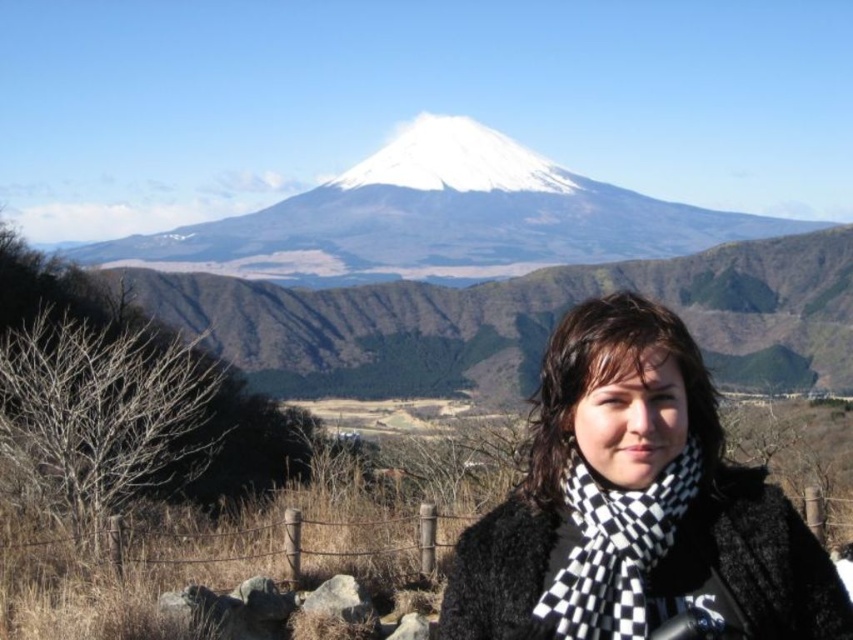
Looking at this image, you are a photographer trying to capture a photo of the black checkered scarf at center from your camera. The camera is 37.31 meters away from the scarf. Considering the camera has a focal length of 50mm and the subject is 37.31 meters away, what is the approximate angle of view required to frame the scarf properly? Assume the scarf is 0.5 meters in length.

To calculate the angle of view, use the formula tan_theta_over_2 equals object_half_length divided by distance. Plugging in the values, tan_theta_over_2 equals 0.25 divided by 37.31, which gives approximately 0.0067. Taking the arctangent of that gives roughly 0.384 degrees for theta_over_2. Multiplying by 2 gives an angle of view of approximately 0.768 degrees. A 50mm lens on a full frame camera has an angle of view of about 46.8 degrees diagonally, so this scarf would easily fit within the frame without a